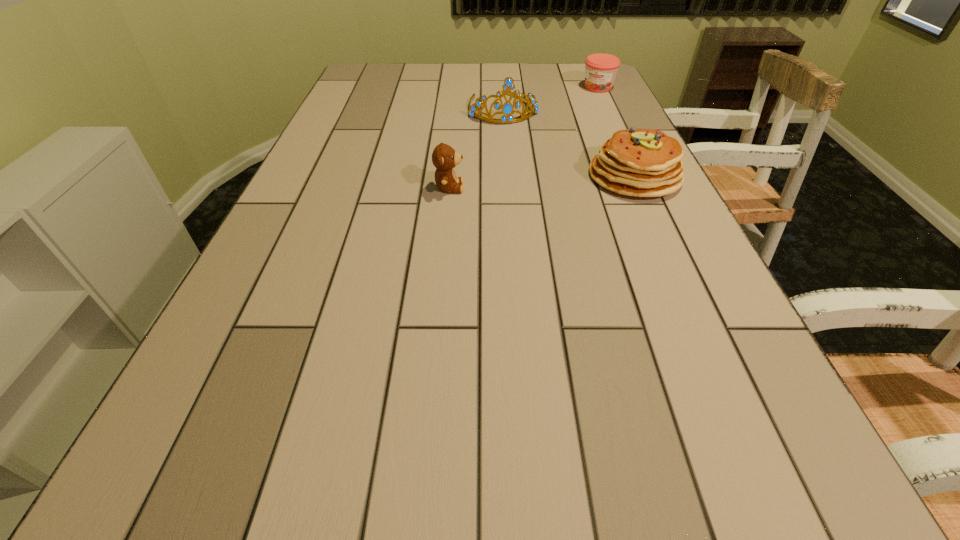
Find the location of a particular element. The image size is (960, 540). free region at the right edge of the desktop is located at coordinates (725, 296).

In the image, there is a desktop. Where is `vacant space at the far left corner`? vacant space at the far left corner is located at coordinates (365, 86).

Image resolution: width=960 pixels, height=540 pixels. Find the location of `free space between the shortest object and the pancake`. free space between the shortest object and the pancake is located at coordinates (616, 132).

Find the location of `vacant area that lies between the pancake and the leftmost object`. vacant area that lies between the pancake and the leftmost object is located at coordinates (541, 182).

This screenshot has height=540, width=960. Identify the location of free space between the third object from right to left and the leftmost object. (476, 148).

Find the location of `free area in between the shortest object and the leftmost object`. free area in between the shortest object and the leftmost object is located at coordinates (523, 138).

At what (x,y) coordinates should I click in order to perform the action: click on vacant space that is in between the tiara and the jam. Please return your answer as a coordinate pair (x, y). The image size is (960, 540). Looking at the image, I should click on (550, 98).

Find the location of `vacant space that is in between the tallest object and the jam`. vacant space that is in between the tallest object and the jam is located at coordinates (550, 98).

Locate an element on the screen. This screenshot has height=540, width=960. free spot between the third object from right to left and the teddy bear is located at coordinates (476, 148).

The height and width of the screenshot is (540, 960). I want to click on empty location between the pancake and the jam, so click(x=616, y=132).